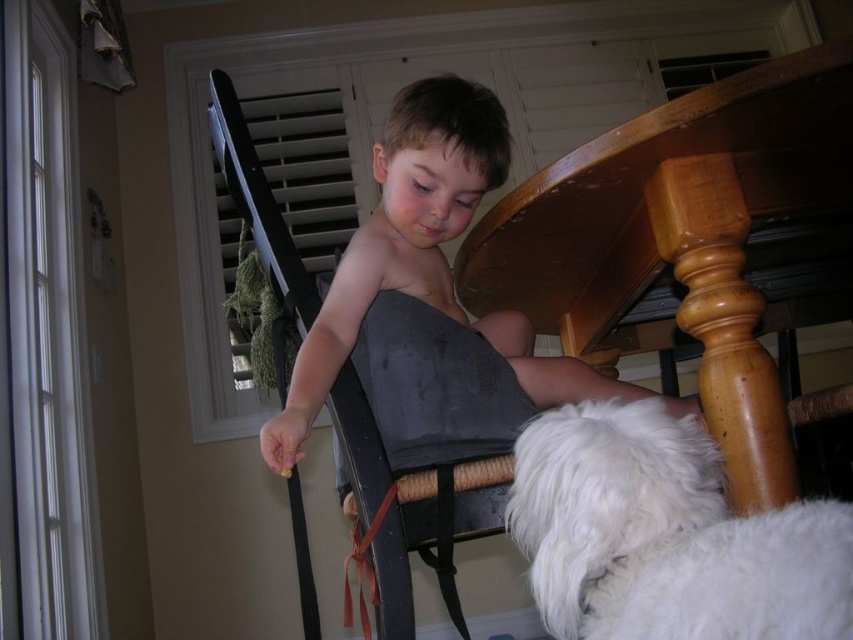
You are a guest entering the room and want to sit on the wooden chair at center. However, there is a red fabric strap at lower center in the way. Can you move the strap to the front of the chair to sit comfortably?

The red fabric strap at lower center is behind the wooden chair at center, so you can move it to the front to sit comfortably.

Looking at this image, you are a delivery robot entering the dining area. You need to navigate around the white fluffy dog at lower right and the red fabric strap at lower center. Which object requires more space to avoid?

The white fluffy dog at lower right might be wider than the red fabric strap at lower center, so you should give more space to the white fluffy dog at lower right to avoid collision.